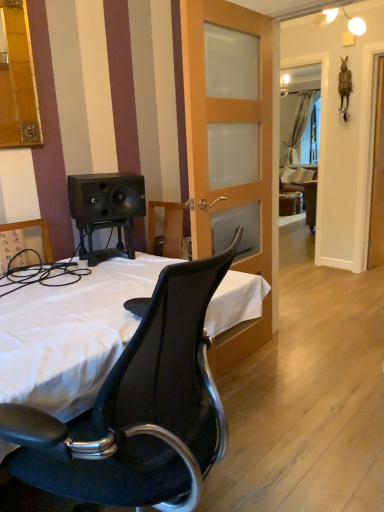
Locate an element on the screen. The width and height of the screenshot is (384, 512). clear glass screen door at right is located at coordinates (377, 178).

The image size is (384, 512). Describe the element at coordinates (377, 178) in the screenshot. I see `clear glass screen door at right` at that location.

Image resolution: width=384 pixels, height=512 pixels. I want to click on white sheer curtain at upper right, so click(x=293, y=124).

Who is more distant, white sheer curtain at upper right or wooden frosted glass door at center?

white sheer curtain at upper right is behind.

Is white sheer curtain at upper right far away from wooden frosted glass door at center?

That's right, there is a large distance between white sheer curtain at upper right and wooden frosted glass door at center.

From a real-world perspective, does white sheer curtain at upper right sit lower than wooden frosted glass door at center?

No, from a real-world perspective, white sheer curtain at upper right is not beneath wooden frosted glass door at center.

Which point is more distant from viewer, (281, 146) or (237, 117)?

The point (281, 146) is behind.

Is white fabric bed at center smaller than clear glass screen door at right?

Incorrect, white fabric bed at center is not smaller in size than clear glass screen door at right.

From the image's perspective, which one is positioned higher, white fabric bed at center or clear glass screen door at right?

From the image's view, clear glass screen door at right is above.

You are a GUI agent. You are given a task and a screenshot of the screen. Output one action in this format:
    pyautogui.click(x=<x>, y=<y>)
    Task: Click on the bed beneath the clear glass screen door at right (from a real-world perspective)
    Image resolution: width=384 pixels, height=512 pixels.
    Given the screenshot: What is the action you would take?
    pyautogui.click(x=71, y=335)

Which object is thinner, white fabric bed at center or clear glass screen door at right?

clear glass screen door at right is thinner.

Is white sheer curtain at upper right positioned with its back to white fabric bed at center?

white sheer curtain at upper right does not have its back to white fabric bed at center.

What's the angular difference between white sheer curtain at upper right and white fabric bed at center's facing directions?

The facing directions of white sheer curtain at upper right and white fabric bed at center are 88.1 degrees apart.

I want to click on curtain above the white fabric bed at center (from a real-world perspective), so click(293, 124).

From the image's perspective, which is above, white sheer curtain at upper right or white fabric bed at center?

white sheer curtain at upper right.

Does clear glass screen door at right have a lesser width compared to wooden frosted glass door at center?

Yes, clear glass screen door at right is thinner than wooden frosted glass door at center.

How much distance is there between clear glass screen door at right and wooden frosted glass door at center?

They are 2.06 meters apart.

Would you say wooden frosted glass door at center is part of clear glass screen door at right's contents?

That's incorrect, wooden frosted glass door at center is not inside clear glass screen door at right.

Can you confirm if clear glass screen door at right is bigger than white fabric bed at center?

No, clear glass screen door at right is not bigger than white fabric bed at center.

Is clear glass screen door at right beside white fabric bed at center?

clear glass screen door at right and white fabric bed at center are not in contact.

Is point (374, 188) closer to viewer compared to point (14, 308)?

No, (374, 188) is further to viewer.

I want to click on screen door on the right of the white fabric bed at center, so click(x=377, y=178).

Could you tell me if wooden frosted glass door at center is turned towards clear glass screen door at right?

No.

Does wooden frosted glass door at center appear on the left side of clear glass screen door at right?

Correct, you'll find wooden frosted glass door at center to the left of clear glass screen door at right.

Is wooden frosted glass door at center touching clear glass screen door at right?

No, wooden frosted glass door at center is not making contact with clear glass screen door at right.

In terms of height, does wooden frosted glass door at center look taller or shorter compared to clear glass screen door at right?

Considering their sizes, wooden frosted glass door at center has more height than clear glass screen door at right.

From a real-world perspective, is clear glass screen door at right located higher than white sheer curtain at upper right?

No, from a real-world perspective, clear glass screen door at right is not above white sheer curtain at upper right.

Based on the photo, is clear glass screen door at right completely or partially outside of white sheer curtain at upper right?

Indeed, clear glass screen door at right is completely outside white sheer curtain at upper right.

Which is more to the left, clear glass screen door at right or white sheer curtain at upper right?

Positioned to the left is clear glass screen door at right.

The height and width of the screenshot is (512, 384). I want to click on curtain located on the right of wooden frosted glass door at center, so click(x=293, y=124).

Locate an element on the screen. bed below the clear glass screen door at right (from the image's perspective) is located at coordinates (71, 335).

From the image, which object appears to be farther from clear glass screen door at right, wooden frosted glass door at center or white sheer curtain at upper right?

Among the two, white sheer curtain at upper right is located further to clear glass screen door at right.

When comparing their distances from wooden frosted glass door at center, does white fabric bed at center or white sheer curtain at upper right seem further?

white sheer curtain at upper right is positioned further to the anchor wooden frosted glass door at center.

When comparing their distances from white sheer curtain at upper right, does white fabric bed at center or clear glass screen door at right seem closer?

clear glass screen door at right is positioned closer to the anchor white sheer curtain at upper right.

Which object lies further to the anchor point clear glass screen door at right, white fabric bed at center or wooden frosted glass door at center?

white fabric bed at center lies further to clear glass screen door at right than the other object.

Based on their spatial positions, is clear glass screen door at right or white sheer curtain at upper right further from wooden frosted glass door at center?

Based on the image, white sheer curtain at upper right appears to be further to wooden frosted glass door at center.

Considering their positions, is wooden frosted glass door at center positioned closer to white sheer curtain at upper right than white fabric bed at center?

wooden frosted glass door at center lies closer to white sheer curtain at upper right than the other object.

Based on their spatial positions, is clear glass screen door at right or wooden frosted glass door at center further from white fabric bed at center?

clear glass screen door at right is further to white fabric bed at center.

Consider the image. Based on their spatial positions, is clear glass screen door at right or wooden frosted glass door at center closer to white sheer curtain at upper right?

The object closer to white sheer curtain at upper right is clear glass screen door at right.

At what (x,y) coordinates should I click in order to perform the action: click on screen door positioned between wooden frosted glass door at center and white sheer curtain at upper right from near to far. Please return your answer as a coordinate pair (x, y). The image size is (384, 512). Looking at the image, I should click on (377, 178).

The width and height of the screenshot is (384, 512). What are the coordinates of `door between white fabric bed at center and white sheer curtain at upper right along the z-axis` in the screenshot? It's located at (230, 125).

The image size is (384, 512). In order to click on door located between white fabric bed at center and clear glass screen door at right in the depth direction in this screenshot , I will do `click(230, 125)`.

This screenshot has width=384, height=512. I want to click on screen door located between white fabric bed at center and white sheer curtain at upper right in the depth direction, so click(377, 178).